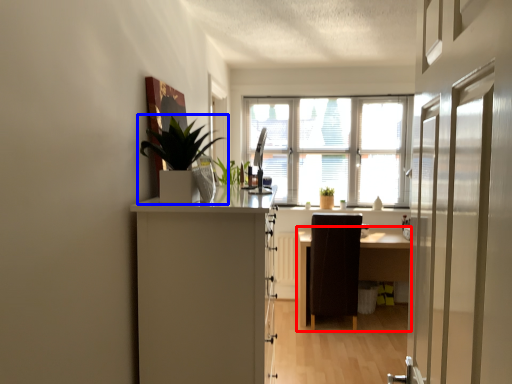
Question: Which point is further to the camera, table (highlighted by a red box) or houseplant (highlighted by a blue box)?

Choices:
 (A) table
 (B) houseplant

Answer: (A)